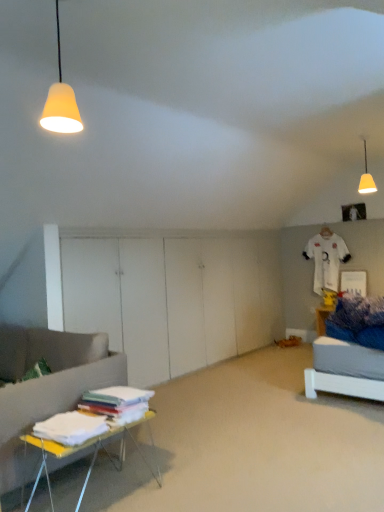
The width and height of the screenshot is (384, 512). Find the location of `vacant area on the back side of white plastic table at lower left`. vacant area on the back side of white plastic table at lower left is located at coordinates (137, 457).